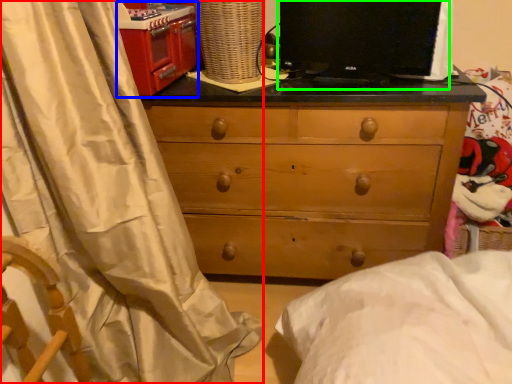
Question: Which object is positioned closest to curtain (highlighted by a red box)? Select from appliance (highlighted by a blue box) and computer monitor (highlighted by a green box).

Choices:
 (A) appliance
 (B) computer monitor

Answer: (A)